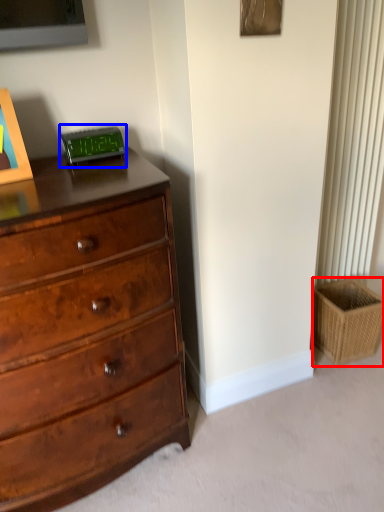
Question: Which object appears farthest to the camera in this image, basket (highlighted by a red box) or alarm clock (highlighted by a blue box)?

Choices:
 (A) basket
 (B) alarm clock

Answer: (A)